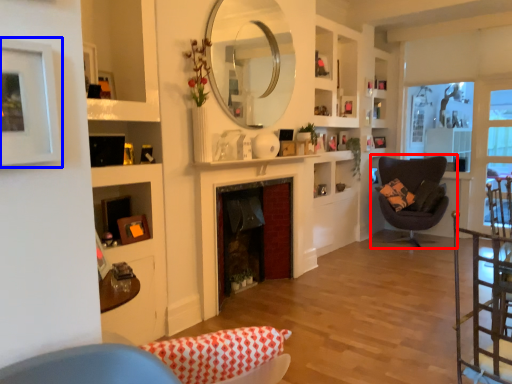
Question: Which of the following is the closest to the observer, chair (highlighted by a red box) or picture frame (highlighted by a blue box)?

Choices:
 (A) chair
 (B) picture frame

Answer: (B)